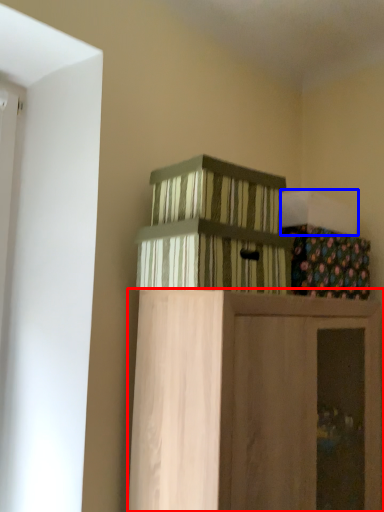
Question: Which of the following is the closest to the observer, furniture (highlighted by a red box) or box (highlighted by a blue box)?

Choices:
 (A) furniture
 (B) box

Answer: (A)